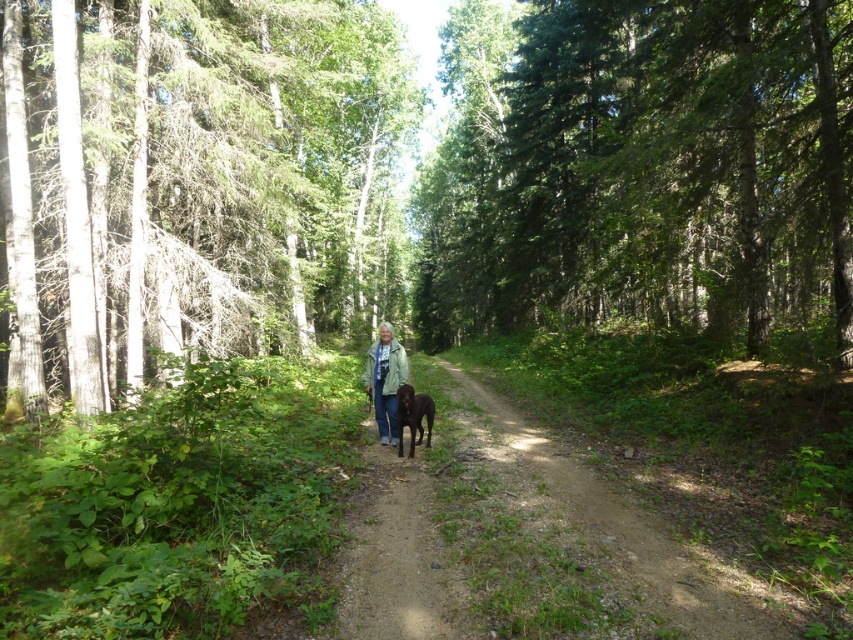
You are standing at the entrance of the forest path and want to find the smooth bark tree at center. According to the coordinates provided, in which direction should you walk to reach it?

The smooth bark tree at center is located at coordinates point (194, 180). Since the coordinate system likely places (0, 0) at the bottom left corner, you should walk towards the upper right direction to reach it.

You are standing at point (397, 452) and want to walk to point (512, 212). Which direction should you move relative to the path?

Point (512, 212) is behind point (397, 452), so you should move backward along the path to reach it.

You are a hiker who wants to ensure your backpack won not interfere with your dog. You see a green textured jacket at center and a shiny brown fur at center. Which item is larger and needs more space?

The green textured jacket at center is bigger than the shiny brown fur at center, so it requires more space.